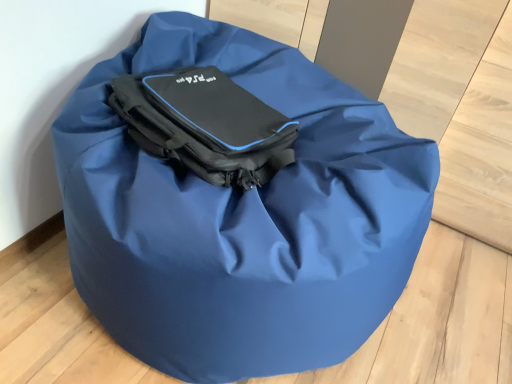
The image size is (512, 384). Find the location of `matte black bag at center`. matte black bag at center is located at coordinates (206, 125).

This screenshot has width=512, height=384. Describe the element at coordinates (206, 125) in the screenshot. I see `matte black bag at center` at that location.

From the picture: What is the approximate width of matte black bag at center?

matte black bag at center is 39.08 centimeters in width.

The width and height of the screenshot is (512, 384). In order to click on matte blue bag at center in this screenshot , I will do `click(241, 217)`.

What do you see at coordinates (241, 217) in the screenshot? I see `matte blue bag at center` at bounding box center [241, 217].

Locate an element on the screen. matte black bag at center is located at coordinates (206, 125).

Does matte blue bag at center appear on the right side of matte black bag at center?

Yes, matte blue bag at center is to the right of matte black bag at center.

Relative to matte black bag at center, is matte blue bag at center in front or behind?

Visually, matte blue bag at center is located in front of matte black bag at center.

Is point (333, 316) positioned in front of point (199, 121)?

Yes, it is in front of point (199, 121).

From the image's perspective, relative to matte black bag at center, is matte blue bag at center above or below?

Clearly, from the image's perspective, matte blue bag at center is below matte black bag at center.

From a real-world perspective, is matte blue bag at center physically below matte black bag at center?

Yes, from a real-world perspective, matte blue bag at center is under matte black bag at center.

Is matte blue bag at center wider than matte black bag at center?

Yes, matte blue bag at center is wider than matte black bag at center.

Who is taller, matte blue bag at center or matte black bag at center?

Standing taller between the two is matte blue bag at center.

Between matte blue bag at center and matte black bag at center, which one has smaller size?

With smaller size is matte black bag at center.

In the scene shown: Is matte blue bag at center spatially inside matte black bag at center, or outside of it?

matte blue bag at center lies outside matte black bag at center.

Are matte blue bag at center and matte black bag at center far apart?

No, there isn't a large distance between matte blue bag at center and matte black bag at center.

Is matte blue bag at center facing towards matte black bag at center?

No, matte blue bag at center is not facing towards matte black bag at center.

How different are the orientations of matte blue bag at center and matte black bag at center in degrees?

matte blue bag at center and matte black bag at center are facing 8.89 degrees away from each other.

You are a GUI agent. You are given a task and a screenshot of the screen. Output one action in this format:
    pyautogui.click(x=<x>, y=<y>)
    Task: Click on the luggage and bags on the right of matte black bag at center
    
    Given the screenshot: What is the action you would take?
    pyautogui.click(x=241, y=217)

Looking at this image, is matte black bag at center to the left of matte blue bag at center from the viewer's perspective?

Yes.

Between matte black bag at center and matte blue bag at center, which one is positioned in front?

matte blue bag at center is closer to the camera.

Is point (165, 101) positioned before point (63, 167)?

No, it is behind (63, 167).

From the image's perspective, relative to matte blue bag at center, is matte black bag at center above or below?

From the image's perspective, matte black bag at center appears above matte blue bag at center.

From a real-world perspective, between matte black bag at center and matte blue bag at center, who is vertically lower?

matte blue bag at center is physically lower.

Considering the sizes of matte black bag at center and matte blue bag at center in the image, is matte black bag at center wider or thinner than matte blue bag at center?

Clearly, matte black bag at center has less width compared to matte blue bag at center.

Which of these two, matte black bag at center or matte blue bag at center, stands taller?

matte blue bag at center.

In terms of size, does matte black bag at center appear bigger or smaller than matte blue bag at center?

matte black bag at center is smaller than matte blue bag at center.

Looking at this image, is matte black bag at center inside or outside of matte blue bag at center?

matte black bag at center is spatially positioned inside matte blue bag at center.

Is matte black bag at center far away from matte blue bag at center?

That's not correct — matte black bag at center is a little close to matte blue bag at center.

Is matte black bag at center positioned with its back to matte blue bag at center?

Correct, matte black bag at center is looking away from matte blue bag at center.

In the image, there is a matte blue bag at center. Where is `pack above it (from the image's perspective)`? This screenshot has width=512, height=384. pack above it (from the image's perspective) is located at coordinates (206, 125).

Identify the location of luggage and bags below the matte black bag at center (from a real-world perspective). (241, 217).

Find the location of a particular element. Image resolution: width=512 pixels, height=384 pixels. pack above the matte blue bag at center (from a real-world perspective) is located at coordinates (206, 125).